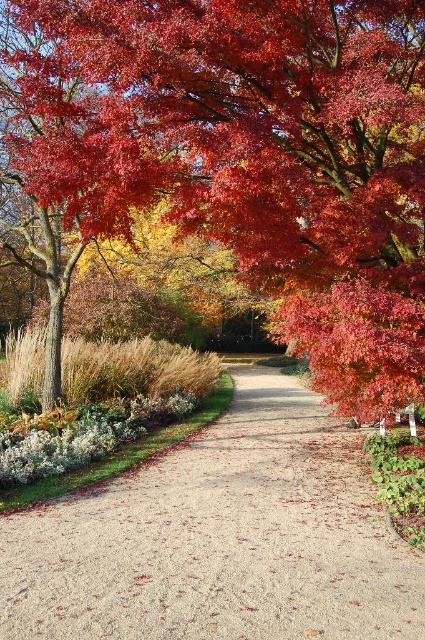
Question: Estimate the real-world distances between objects in this image. Which object is closer to the glossy red maple leaf at upper right?

Choices:
 (A) gravel path at center
 (B) shiny red maple tree at center

Answer: (A)

Question: Is gravel path at center further to the viewer compared to glossy red maple leaf at upper right?

Choices:
 (A) yes
 (B) no

Answer: (B)

Question: Which point is closer to the camera taking this photo?

Choices:
 (A) (354, 33)
 (B) (345, 369)

Answer: (B)

Question: Does shiny red maple tree at center have a smaller size compared to gravel path at center?

Choices:
 (A) yes
 (B) no

Answer: (A)

Question: Which object appears closest to the camera in this image?

Choices:
 (A) glossy red maple leaf at upper right
 (B) gravel path at center

Answer: (B)

Question: Does shiny red maple tree at center have a lesser width compared to gravel path at center?

Choices:
 (A) yes
 (B) no

Answer: (A)